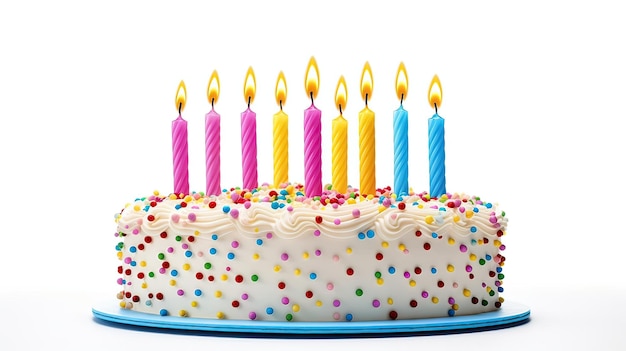
Image resolution: width=626 pixels, height=351 pixels. In order to click on pink candles in this screenshot , I will do `click(176, 145)`, `click(211, 137)`, `click(249, 133)`, `click(317, 139)`.